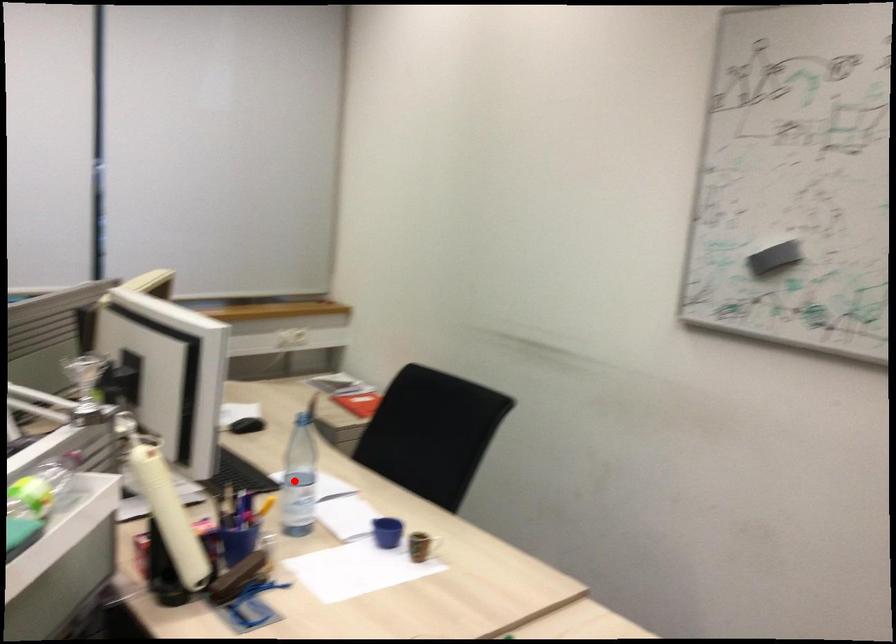
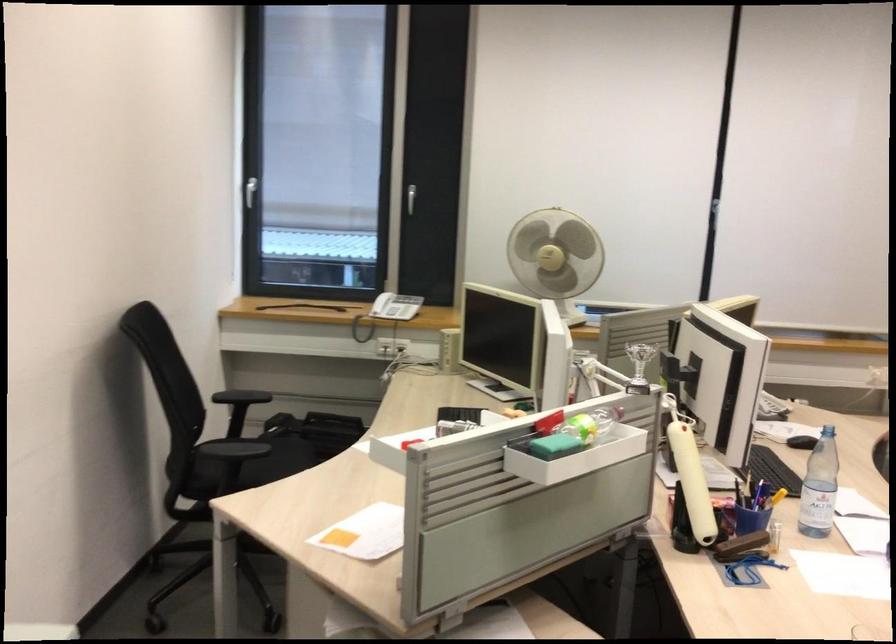
Find the pixel in the second image that matches the highlighted location in the first image.

(819, 487)